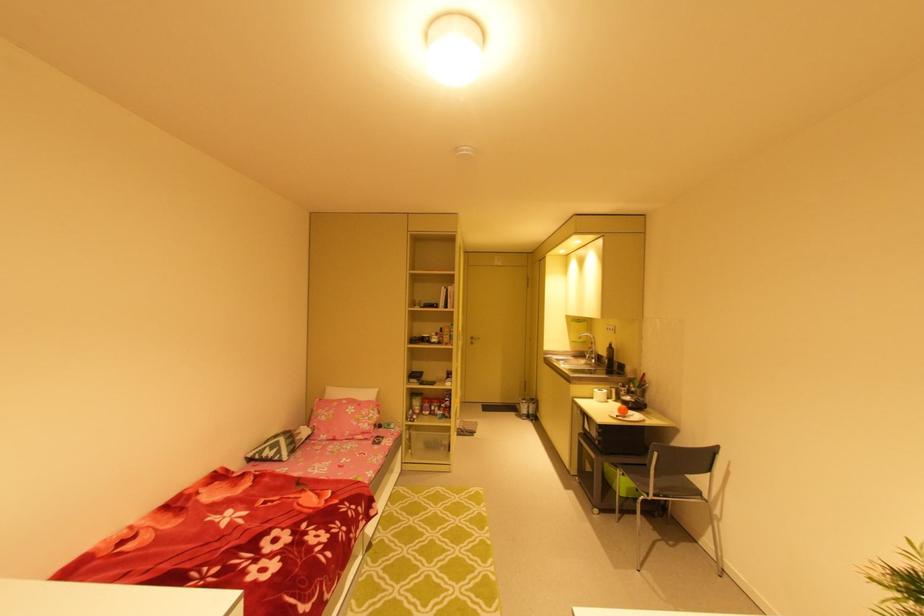
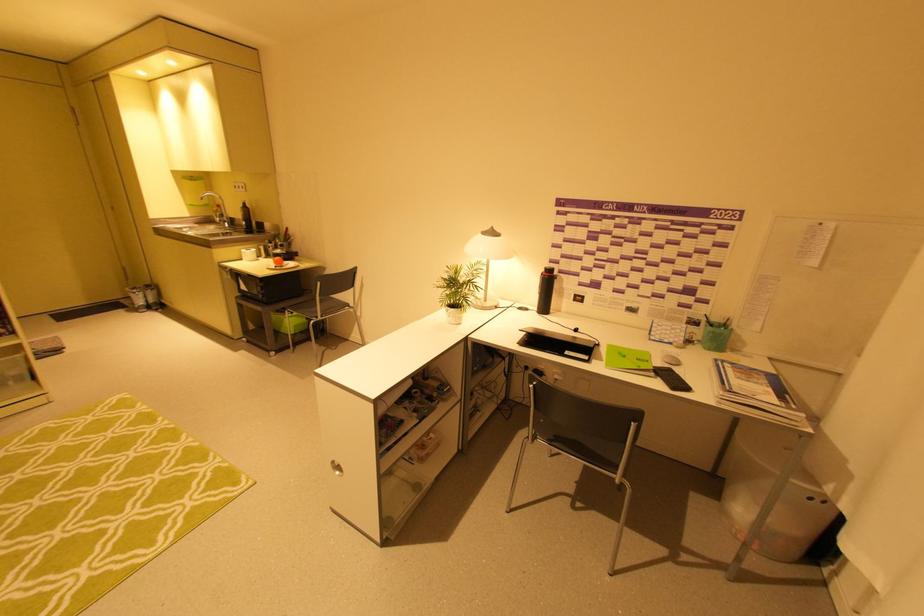
In the second image, find the point that corresponds to point 631,474 in the first image.

(299, 310)